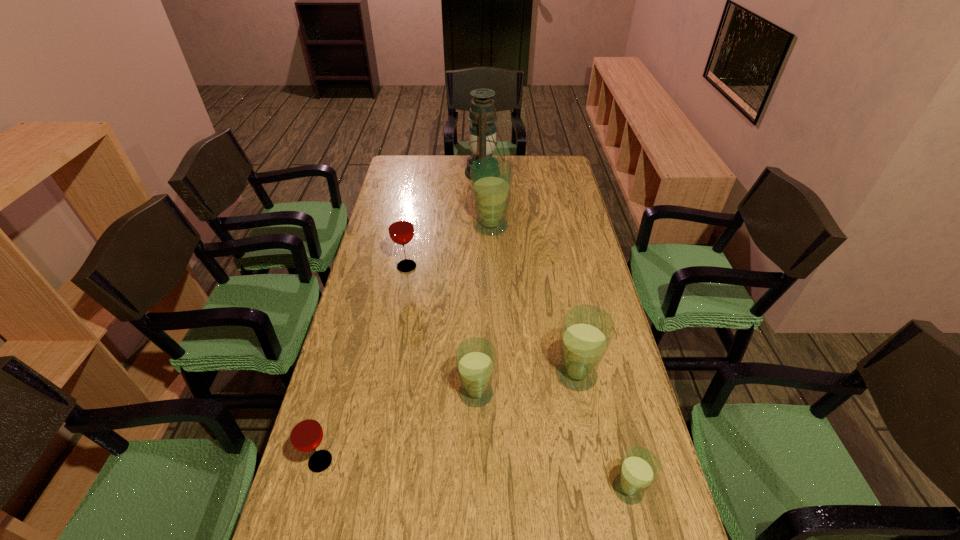
This screenshot has width=960, height=540. Find the location of `the shortest glass`. the shortest glass is located at coordinates (640, 468).

In order to click on the nearest blue glass in this screenshot , I will do `click(640, 468)`.

You are a GUI agent. You are given a task and a screenshot of the screen. Output one action in this format:
    pyautogui.click(x=<x>, y=<y>)
    Task: Click on the vacant space positioned on the left of the farthest object
    Image resolution: width=960 pixels, height=540 pixels.
    Given the screenshot: What is the action you would take?
    pyautogui.click(x=422, y=173)

Find the location of a particular element. The image size is (960, 540). free location located 0.130m on the left of the biggest blue glass is located at coordinates (439, 226).

You are a GUI agent. You are given a task and a screenshot of the screen. Output one action in this format:
    pyautogui.click(x=<x>, y=<y>)
    Task: Click on the vacant region located 0.260m on the right of the farther red glass
    
    Given the screenshot: What is the action you would take?
    pyautogui.click(x=491, y=267)

Identify the location of blank space located on the front of the third smallest blue glass. (601, 507).

Identify the location of vacant space located on the back of the nearer red glass. The image size is (960, 540). (341, 386).

At what (x,y) coordinates should I click in order to perform the action: click on blank area located 0.280m on the back of the third biggest blue glass. Please return your answer as a coordinate pair (x, y). Looking at the image, I should click on (477, 306).

The width and height of the screenshot is (960, 540). In order to click on free location located on the left of the smallest blue glass in this screenshot , I will do `click(457, 489)`.

At what (x,y) coordinates should I click in order to perform the action: click on object present at the far edge. Please return your answer as a coordinate pair (x, y). The width and height of the screenshot is (960, 540). Looking at the image, I should click on (482, 139).